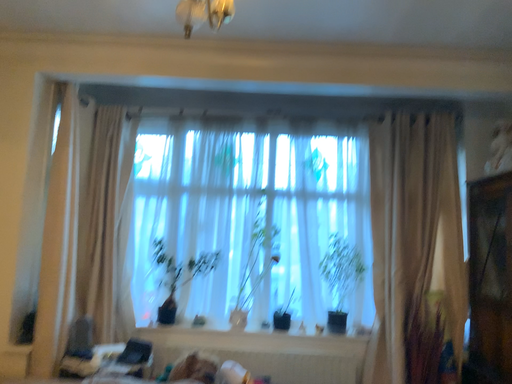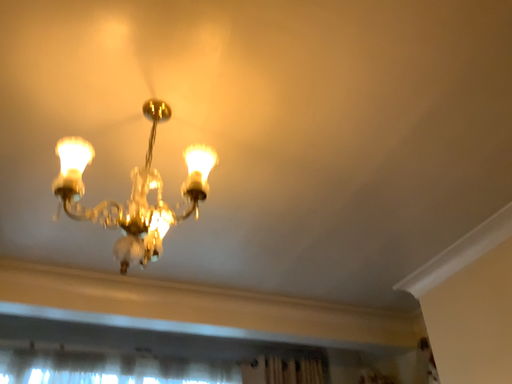
Question: Which way did the camera rotate in the video?

Choices:
 (A) rotated left
 (B) rotated right

Answer: (B)